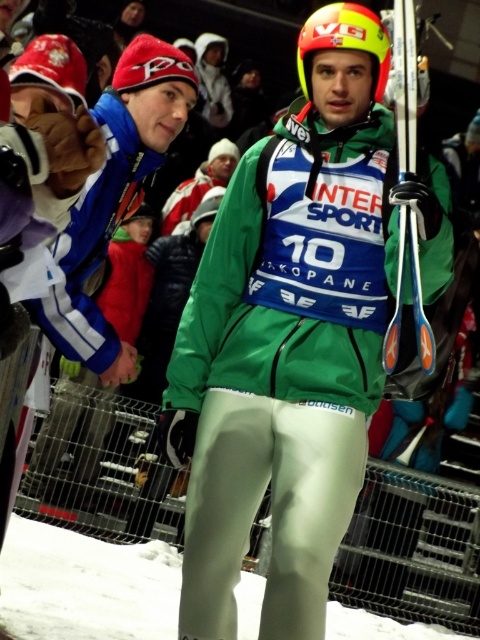
Question: Considering the relative positions of green matte jacket at center and white matte snow at lower center in the image provided, where is green matte jacket at center located with respect to white matte snow at lower center?

Choices:
 (A) left
 (B) right

Answer: (B)

Question: Which of these objects is positioned farthest from the green matte jacket at center?

Choices:
 (A) shiny metallic ski at center
 (B) white matte snow at lower center

Answer: (B)

Question: Is shiny metallic ski at center closer to the viewer compared to yellow matte helmet at center?

Choices:
 (A) no
 (B) yes

Answer: (B)

Question: Which point is closer to the camera?

Choices:
 (A) (300, 54)
 (B) (248, 531)

Answer: (B)

Question: Which of these objects is positioned farthest from the yellow matte helmet at center?

Choices:
 (A) green matte jacket at center
 (B) white matte snow at lower center

Answer: (B)

Question: Does white matte snow at lower center have a greater width compared to red knit cap at upper left?

Choices:
 (A) no
 (B) yes

Answer: (B)